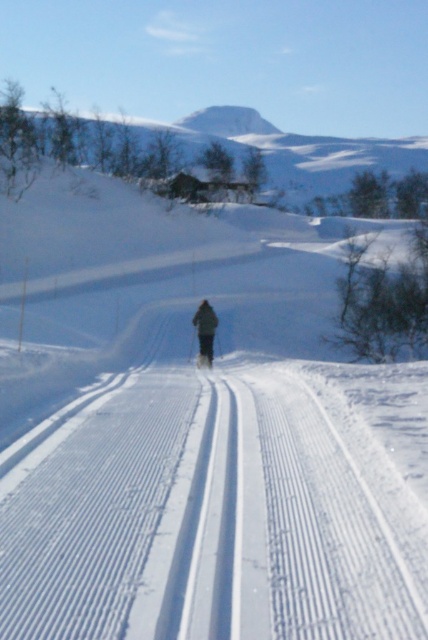
You are a photographer planning to take a picture of the dark green fabric at center and the white matte ski at center in the winter scene. Which object should you focus on first if you want to ensure both are in sharp focus?

The dark green fabric at center is taller than the white matte ski at center, so focusing on the dark green fabric at center first would help ensure both are in sharp focus since it is larger.

You are a photographer planning to take a closeup shot of the dark green fabric at center and the white matte ski at center. Which object should you focus on if you want the one that takes up more space in the photo?

The dark green fabric at center is bigger than the white matte ski at center, so you should focus on the dark green fabric at center to capture the object that takes up more space in the photo.

You are a photographer planning to capture the skier and the ski in the image. The camera frame can only accommodate objects up to the width of the white matte ski at center. Will the dark green fabric at center fit within the frame?

The dark green fabric at center is wider than the white matte ski at center, so it will not fit within the camera frame designed for the ski.